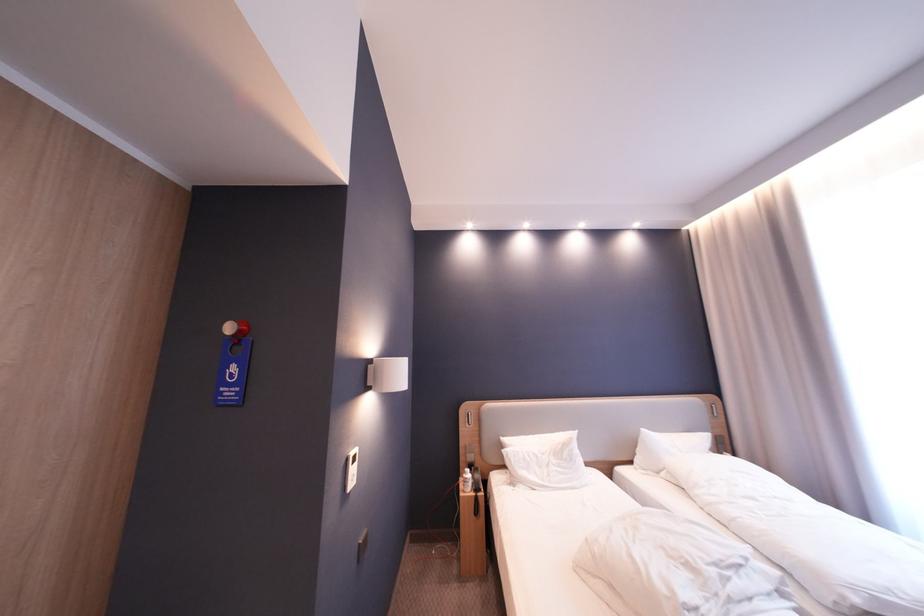
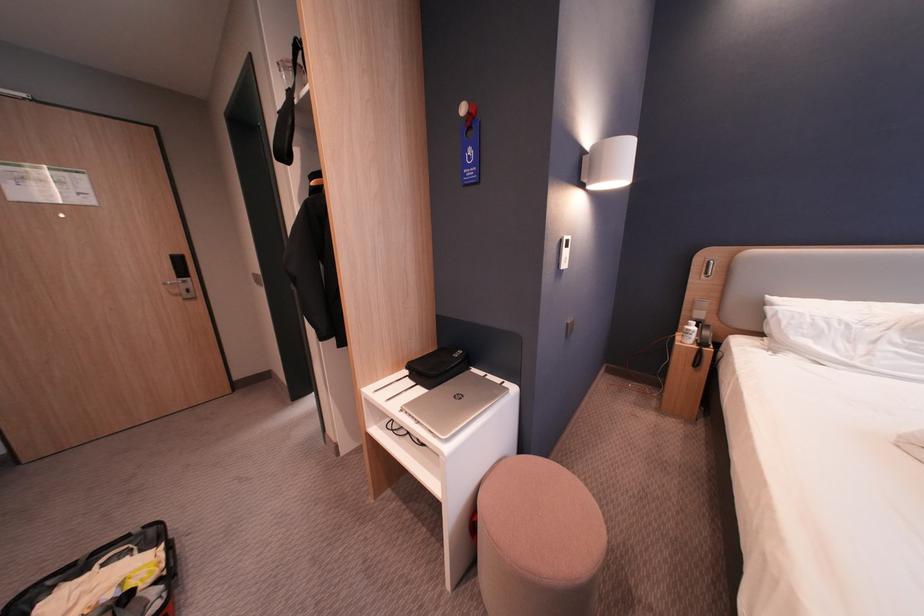
Based on the continuous images, in which direction is the camera rotating?

The rotation direction of the camera is left-down.